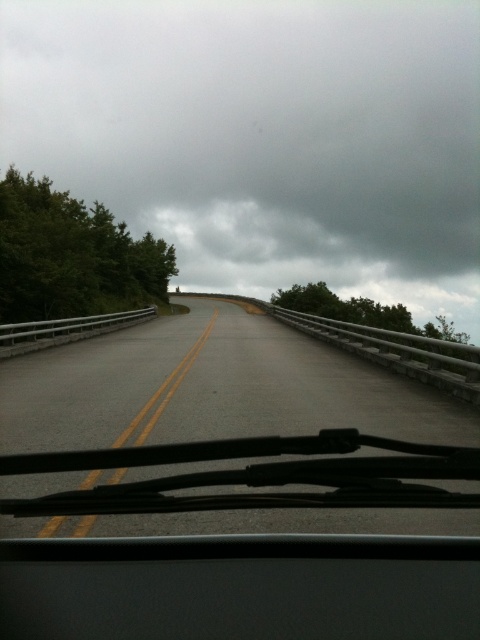
You are driving a car with a trunk that needs to be opened. The trunk is connected to the transparent rubber windshield wipers at bottom. If the distance between them is 31.78 feet, can you estimate whether the trunk can be opened without hitting the asphalt road at center?

The distance between the asphalt road at center and the transparent rubber windshield wipers at bottom is 31.78 feet. Since the trunk is connected to the transparent rubber windshield wipers at bottom, opening it would require ensuring there is enough space. However, 31.78 feet is a significant distance, so the trunk should open without hitting the asphalt road at center.

You are driving in the rain and need to clean the raindrops off your windshield. You see the transparent rubber windshield wipers at bottom and the asphalt road at center. Which object is closer to you, the driver?

The transparent rubber windshield wipers at bottom are closer to you since they are positioned below the asphalt road at center, which is located above them.

You are driving a car and notice the transparent rubber windshield wipers at bottom and the asphalt road at center. Which object takes up more space in your view?

The asphalt road at center takes up more space in your view because it is bigger than the transparent rubber windshield wipers at bottom.